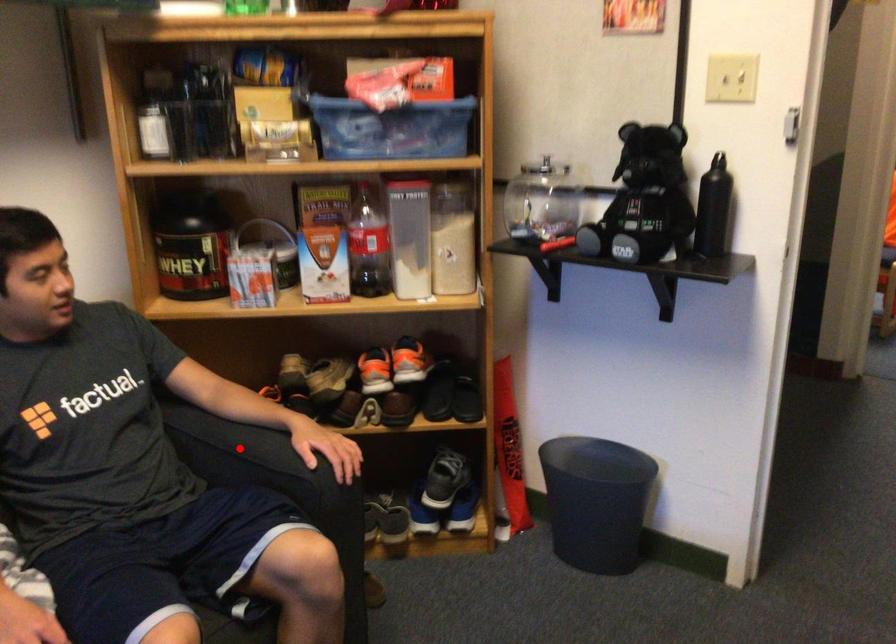
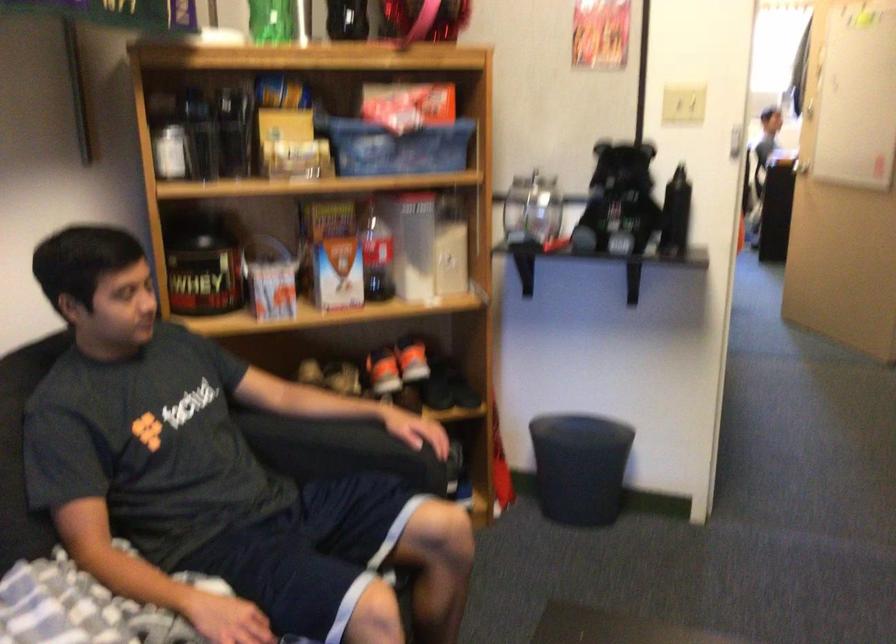
Find the pixel in the second image that matches the highlighted location in the first image.

(330, 444)